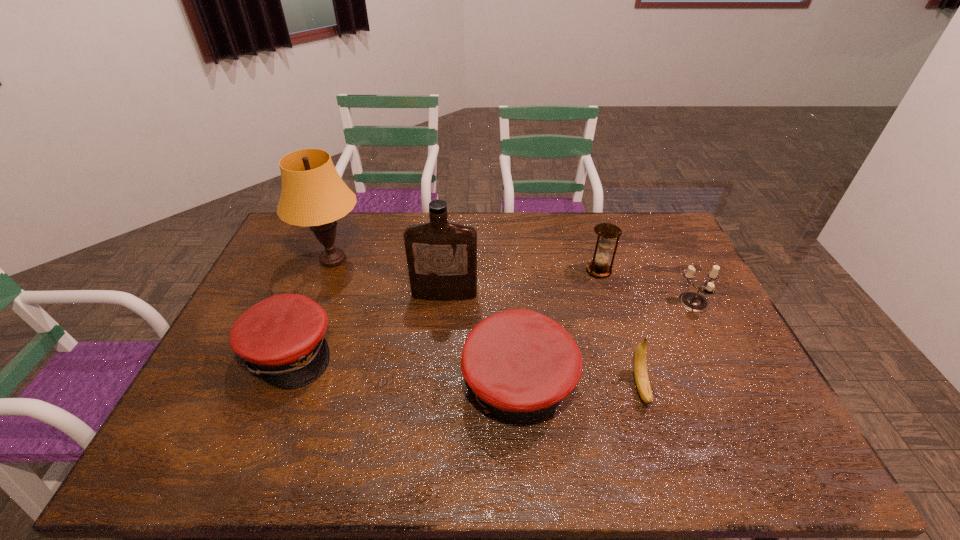
Where is `object positioned at the right edge`? This screenshot has width=960, height=540. object positioned at the right edge is located at coordinates (692, 301).

The image size is (960, 540). Find the location of `object that is at the far left corner`. object that is at the far left corner is located at coordinates (313, 194).

Locate an element on the screen. The image size is (960, 540). free region at the far edge of the desktop is located at coordinates (614, 245).

Find the location of a particular element. The width and height of the screenshot is (960, 540). vacant region at the left edge of the desktop is located at coordinates (251, 298).

Where is `vacant region at the right edge of the desktop`? This screenshot has height=540, width=960. vacant region at the right edge of the desktop is located at coordinates (695, 333).

In the image, there is a desktop. Find the location of `free space at the far right corner`. free space at the far right corner is located at coordinates (645, 234).

Image resolution: width=960 pixels, height=540 pixels. Find the location of `free region at the near right corner of the desktop`. free region at the near right corner of the desktop is located at coordinates (769, 418).

In order to click on free space between the left cap and the liquor in this screenshot , I will do `click(367, 323)`.

Image resolution: width=960 pixels, height=540 pixels. Find the location of `vacant area between the lampshade and the candle holder`. vacant area between the lampshade and the candle holder is located at coordinates (514, 281).

Where is `unoccupied area between the rightmost object and the lampshade`? This screenshot has height=540, width=960. unoccupied area between the rightmost object and the lampshade is located at coordinates (514, 281).